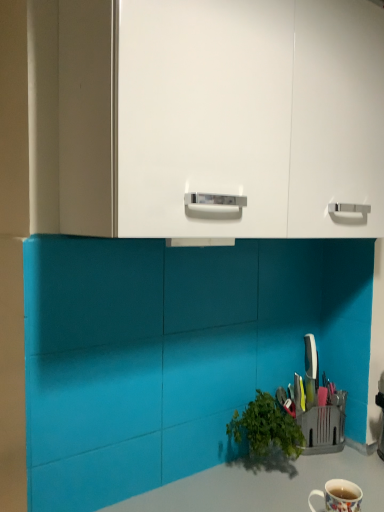
Question: Would you say white glossy mug at lower right is to the left or to the right of smooth gray countertop at lower center in the picture?

Choices:
 (A) left
 (B) right

Answer: (B)

Question: Is white glossy mug at lower right spatially inside smooth gray countertop at lower center, or outside of it?

Choices:
 (A) outside
 (B) inside

Answer: (A)

Question: Estimate the real-world distances between objects in this image. Which object is closer to the smooth gray countertop at lower center?

Choices:
 (A) white glossy cabinet at upper center
 (B) white glossy mug at lower right

Answer: (B)

Question: Considering the real-world distances, which object is farthest from the white glossy mug at lower right?

Choices:
 (A) white glossy cabinet at upper center
 (B) smooth gray countertop at lower center

Answer: (A)